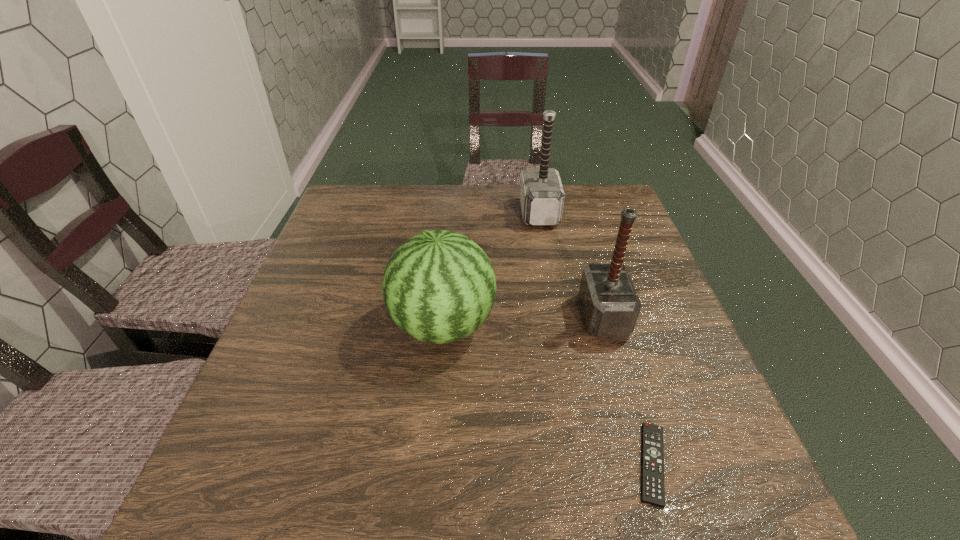
Locate an element on the screen. Image resolution: width=960 pixels, height=540 pixels. the farthest object is located at coordinates (542, 196).

Where is `the nearer hammer`? The width and height of the screenshot is (960, 540). the nearer hammer is located at coordinates (610, 304).

Image resolution: width=960 pixels, height=540 pixels. I want to click on the leftmost object, so click(x=439, y=286).

The image size is (960, 540). Find the location of `the nearest object`. the nearest object is located at coordinates (652, 488).

Locate an element on the screen. The image size is (960, 540). the shortest object is located at coordinates (652, 488).

I want to click on free space located for striking with the head of the farther hammer, so click(454, 213).

Identify the location of free space located for striking with the head of the farther hammer. The image size is (960, 540). 414,213.

Where is `vacant area situated 0.360m for striking with the head of the farther hammer`? vacant area situated 0.360m for striking with the head of the farther hammer is located at coordinates click(400, 213).

I want to click on free space located on the left of the nearer hammer, so click(431, 317).

Locate an element on the screen. The image size is (960, 540). free space located on the front of the leftmost object is located at coordinates (429, 483).